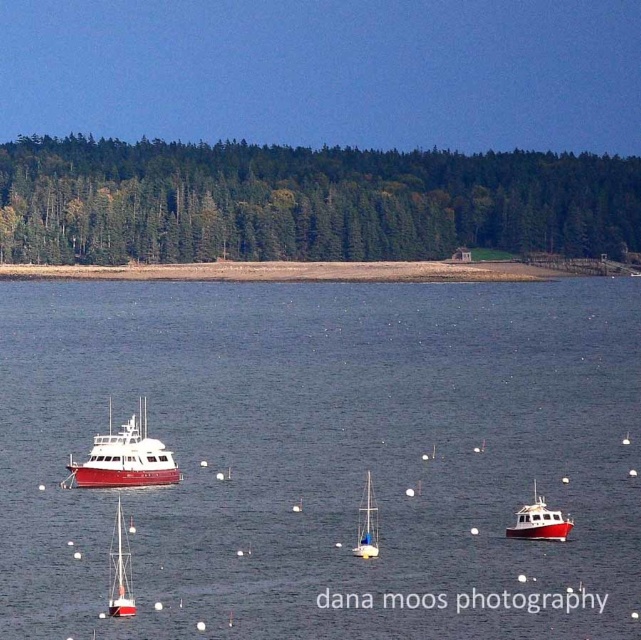
Consider the image. You are a boat operator who needs to navigate between the white matte sailboat at lower left and the white matte sailboat at center. Based on their widths, which boat should you avoid if you want to pass through the narrowest channel between them?

The white matte sailboat at lower left might be wider than the white matte sailboat at center, so you should avoid the white matte sailboat at lower left to navigate through the narrowest channel.

You are standing at the point marked by coordinates point [119,570]. Looking around, you see the white matte sailboat at lower left. Can you confirm if you are currently on the water or on the shore?

The point [119,570] corresponds to the location of the white matte sailboat at lower left, which is on the water. Therefore, you are on the water.